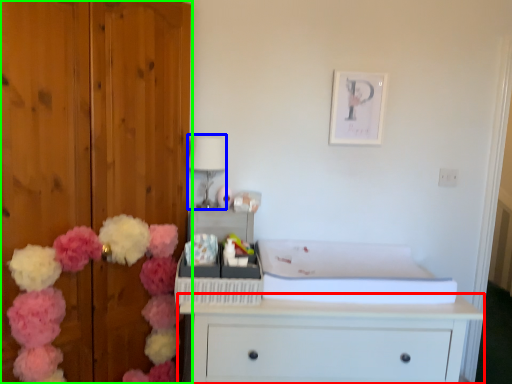
Question: Which object is the closest to the chest of drawers (highlighted by a red box)? Choose among these: lamp (highlighted by a blue box) or door (highlighted by a green box).

Choices:
 (A) lamp
 (B) door

Answer: (B)